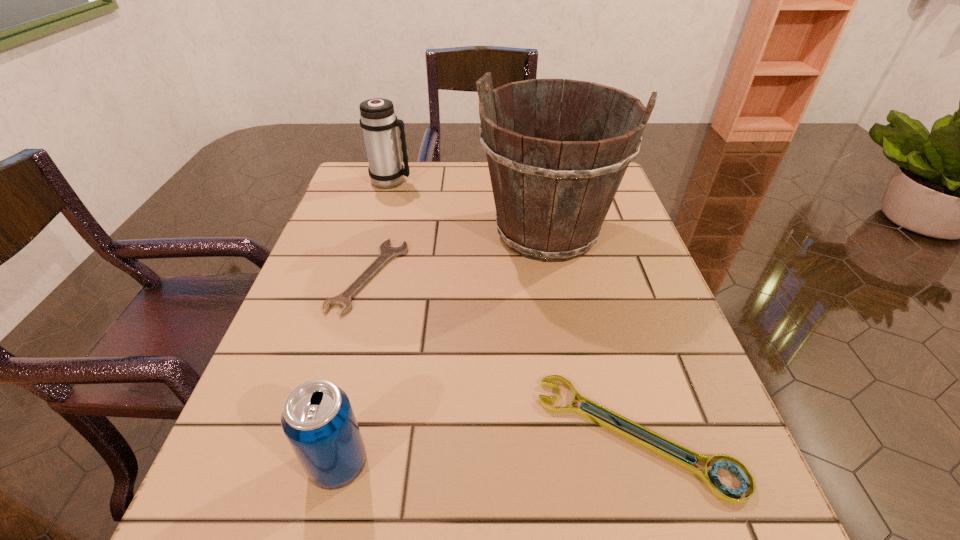
You are a GUI agent. You are given a task and a screenshot of the screen. Output one action in this format:
    pyautogui.click(x=<x>, y=<y>)
    Task: Click on the free space that satisfies the following two spatial constraints: 1. on the side with the handle of the right wrench; 2. on the right side of the thermos bottle
    
    Given the screenshot: What is the action you would take?
    pyautogui.click(x=316, y=435)

Where is `vacant space that satisfies the following two spatial constraints: 1. on the side with the handle of the second tallest object; 2. on the right side of the pop soda`? vacant space that satisfies the following two spatial constraints: 1. on the side with the handle of the second tallest object; 2. on the right side of the pop soda is located at coordinates (307, 463).

The width and height of the screenshot is (960, 540). What are the coordinates of `vacant space that satisfies the following two spatial constraints: 1. on the side with the handle of the fourth shortest object; 2. on the right side of the right wrench` in the screenshot? It's located at (316, 435).

The height and width of the screenshot is (540, 960). In order to click on vacant space that satisfies the following two spatial constraints: 1. on the side with the handle of the second tallest object; 2. on the right side of the nearer wrench in this screenshot , I will do `click(316, 435)`.

Locate an element on the screen. vacant space that satisfies the following two spatial constraints: 1. on the back side of the tallest object; 2. on the left side of the pop soda is located at coordinates (395, 232).